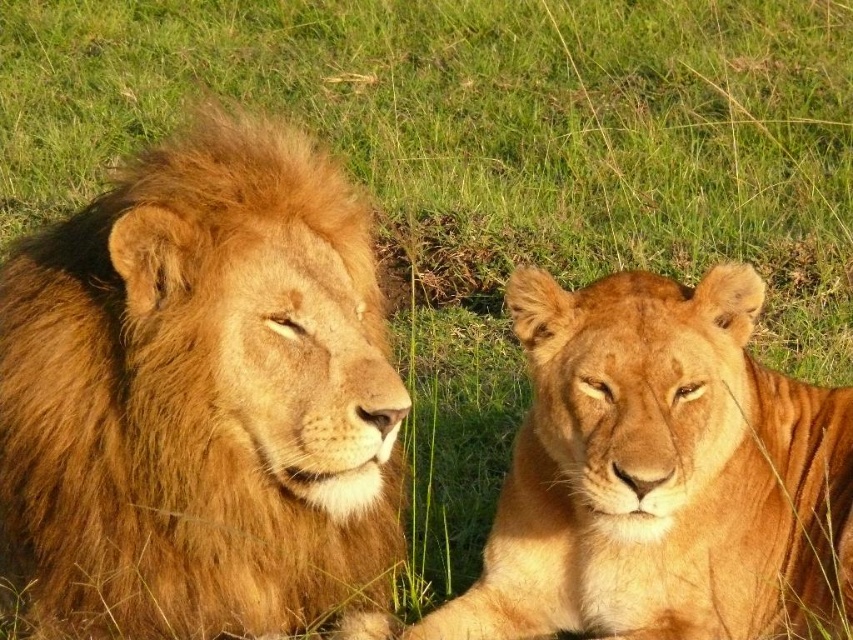
You are standing in the savanna and see two lions. The golden fur lion at left and the golden fur lion at right. Which lion is positioned to the left?

The golden fur lion at left is positioned to the left of the golden fur lion at right.